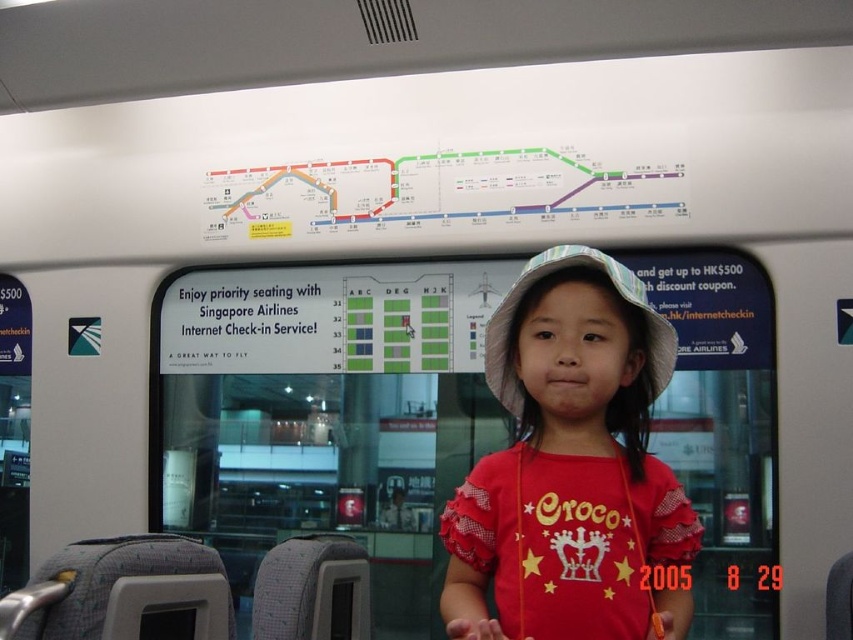
Is red cotton shirt at center to the left of light blue fabric hat at center from the viewer's perspective?

Indeed, red cotton shirt at center is positioned on the left side of light blue fabric hat at center.

Does red cotton shirt at center appear under light blue fabric hat at center?

Yes, red cotton shirt at center is below light blue fabric hat at center.

I want to click on red cotton shirt at center, so pos(570,465).